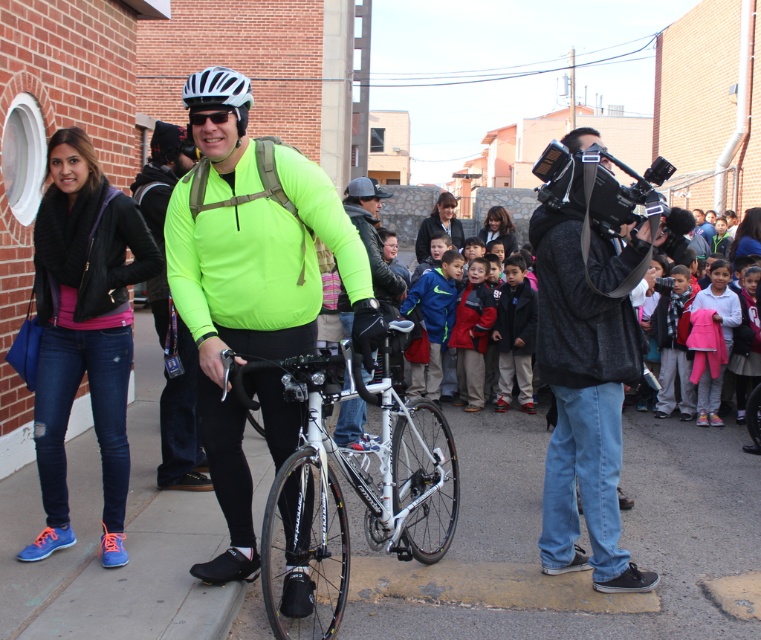
Question: Does dark gray fabric camera at center lie in front of white matte bicycle helmet at upper center?

Choices:
 (A) no
 (B) yes

Answer: (A)

Question: Does neon green fleece jacket at center have a greater width compared to black matte goggles at center?

Choices:
 (A) no
 (B) yes

Answer: (B)

Question: Among these objects, which one is nearest to the camera?

Choices:
 (A) white glossy bicycle at center
 (B) matte black helmet at center
 (C) neon green fleece jacket at center
 (D) black leather jacket at left

Answer: (A)

Question: Which of the following is the farthest from the observer?

Choices:
 (A) neon green fabric at center
 (B) white asphalt at center
 (C) dark gray fleece jacket at right

Answer: (C)

Question: Which object is closer to the camera taking this photo?

Choices:
 (A) white asphalt at center
 (B) white glossy bicycle at center
 (C) white matte helmet at center

Answer: (B)

Question: From the image, what is the correct spatial relationship of black matte goggles at center in relation to matte black helmet at center?

Choices:
 (A) above
 (B) below

Answer: (B)